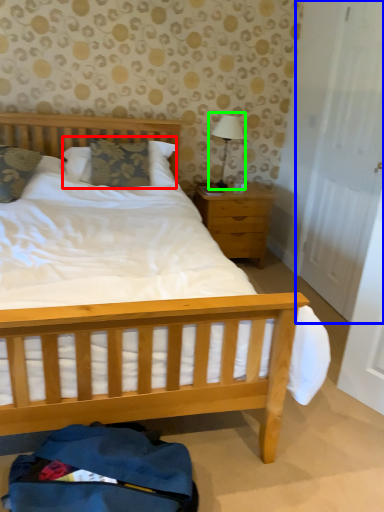
Question: Which is nearer to the pillow (highlighted by a red box)? door (highlighted by a blue box) or table lamp (highlighted by a green box).

Choices:
 (A) door
 (B) table lamp

Answer: (B)